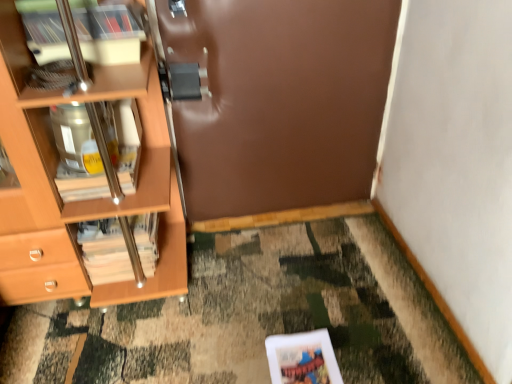
The image size is (512, 384). Describe the element at coordinates (76, 154) in the screenshot. I see `wooden cabinet at left` at that location.

This screenshot has height=384, width=512. What are the coordinates of `wooden/matte magazine at left` in the screenshot? It's located at (104, 251).

Considering the sizes of wooden cabinet at left and brown matte door at center in the image, is wooden cabinet at left taller or shorter than brown matte door at center?

wooden cabinet at left is shorter than brown matte door at center.

Looking at this image, is wooden cabinet at left turned away from brown matte door at center?

No, wooden cabinet at left's orientation is not away from brown matte door at center.

From the image's perspective, which is above, wooden cabinet at left or brown matte door at center?

brown matte door at center is shown above in the image.

Between brown matte door at center and wooden cabinet at left, which one has smaller size?

Smaller between the two is wooden cabinet at left.

From the image's perspective, which is below, brown matte door at center or wooden cabinet at left?

wooden cabinet at left.

Is brown matte door at center not inside wooden cabinet at left?

brown matte door at center lies outside wooden cabinet at left's area.

From a real-world perspective, which object stands above the other?

From a 3D spatial view, wooden cabinet at left is above.

From a real-world perspective, is wooden cabinet at left positioned over wooden/matte magazine at left based on gravity?

Correct, in the physical world, wooden cabinet at left is higher than wooden/matte magazine at left.

Is wooden cabinet at left positioned with its back to wooden/matte magazine at left?

That's not correct — wooden cabinet at left is not looking away from wooden/matte magazine at left.

Are wooden cabinet at left and wooden/matte magazine at left far apart?

No.

Who is bigger, wooden cabinet at left or wooden/matte magazine at left?

wooden/matte magazine at left.

From the image's perspective, is wooden/matte magazine at left under brown matte door at center?

Indeed, from the image's perspective, wooden/matte magazine at left is shown beneath brown matte door at center.

In order to click on magazine below the brown matte door at center (from the image's perspective) in this screenshot , I will do `click(104, 251)`.

Is the position of wooden/matte magazine at left less distant than that of brown matte door at center?

No, the depth of wooden/matte magazine at left is greater than that of brown matte door at center.

Are wooden/matte magazine at left and brown matte door at center making contact?

wooden/matte magazine at left and brown matte door at center are not in contact.

How many degrees apart are the facing directions of wooden/matte magazine at left and wooden cabinet at left?

The facing directions of wooden/matte magazine at left and wooden cabinet at left are 1.73 degrees apart.

Which of these two, wooden/matte magazine at left or wooden cabinet at left, is bigger?

Bigger between the two is wooden/matte magazine at left.

Could you tell me if wooden/matte magazine at left is turned towards wooden cabinet at left?

No, wooden/matte magazine at left is not oriented towards wooden cabinet at left.

Looking at this image, would you say wooden/matte magazine at left is to the left or to the right of wooden cabinet at left in the picture?

wooden/matte magazine at left is to the right of wooden cabinet at left.

Is brown matte door at center inside or outside of wooden/matte magazine at left?

brown matte door at center is spatially situated outside wooden/matte magazine at left.

Is brown matte door at center aimed at wooden/matte magazine at left?

No, brown matte door at center is not turned towards wooden/matte magazine at left.

Is brown matte door at center far from wooden/matte magazine at left?

No, brown matte door at center is in close proximity to wooden/matte magazine at left.

Is brown matte door at center at the left side of wooden/matte magazine at left?

In fact, brown matte door at center is to the right of wooden/matte magazine at left.

Where is `door below the wooden cabinet at left (from a real-world perspective)`? The height and width of the screenshot is (384, 512). door below the wooden cabinet at left (from a real-world perspective) is located at coordinates 280,101.

You are a GUI agent. You are given a task and a screenshot of the screen. Output one action in this format:
    pyautogui.click(x=<x>, y=<y>)
    Task: Click on the door on the right of wooden cabinet at left
    The image size is (512, 384).
    Given the screenshot: What is the action you would take?
    pyautogui.click(x=280, y=101)

When comparing their distances from wooden/matte magazine at left, does wooden cabinet at left or brown matte door at center seem further?

The object further to wooden/matte magazine at left is brown matte door at center.

When comparing their distances from wooden cabinet at left, does brown matte door at center or wooden/matte magazine at left seem closer?

wooden/matte magazine at left is closer to wooden cabinet at left.

Considering their positions, is brown matte door at center positioned closer to wooden/matte magazine at left than wooden cabinet at left?

Among the two, wooden cabinet at left is located nearer to wooden/matte magazine at left.

When comparing their distances from brown matte door at center, does wooden cabinet at left or wooden/matte magazine at left seem further?

wooden/matte magazine at left is positioned further to the anchor brown matte door at center.

Estimate the real-world distances between objects in this image. Which object is closer to wooden cabinet at left, wooden/matte magazine at left or brown matte door at center?

wooden/matte magazine at left.

Looking at the image, which one is located closer to brown matte door at center, wooden/matte magazine at left or wooden cabinet at left?

The object closer to brown matte door at center is wooden cabinet at left.

This screenshot has height=384, width=512. Find the location of `magazine located between wooden cabinet at left and brown matte door at center in the left-right direction`. magazine located between wooden cabinet at left and brown matte door at center in the left-right direction is located at coordinates (104, 251).